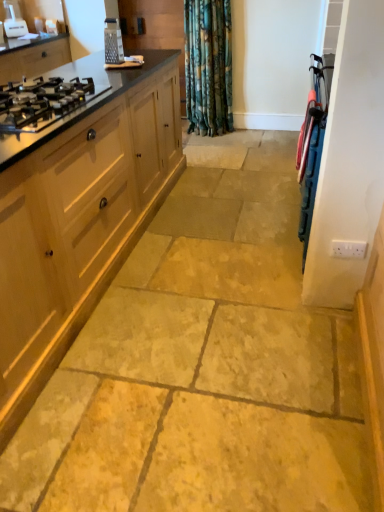
What do you see at coordinates (43, 102) in the screenshot? I see `black glass gas stove at left` at bounding box center [43, 102].

The image size is (384, 512). What do you see at coordinates (349, 161) in the screenshot?
I see `blue plastic screen door at right` at bounding box center [349, 161].

This screenshot has width=384, height=512. Find the location of `black glass gas stove at left`. black glass gas stove at left is located at coordinates (x=43, y=102).

Does point (115, 240) come closer to viewer compared to point (10, 7)?

Yes, it is.

Measure the distance between light wood cabinet at left, placed as the 1th cabinetry when sorted from right to left, and white plastic appliance at upper left, which appears as the 2th appliance when ordered from the bottom.

7.23 feet.

From the image's perspective, is light wood cabinet at left, placed as the first cabinetry when sorted from front to back, positioned above or below white plastic appliance at upper left, the 1th appliance positioned from the left?

Based on their image positions, light wood cabinet at left, placed as the first cabinetry when sorted from front to back, is located beneath white plastic appliance at upper left, the 1th appliance positioned from the left.

Considering the sizes of objects light wood cabinet at left, placed as the 1th cabinetry when sorted from right to left, and white plastic appliance at upper left, the second appliance viewed from the front, in the image provided, who is taller, light wood cabinet at left, placed as the 1th cabinetry when sorted from right to left, or white plastic appliance at upper left, the second appliance viewed from the front,?

light wood cabinet at left, placed as the 1th cabinetry when sorted from right to left, is taller.

Which is more to the left, black glass gas stove at left or light wood cabinet at left, positioned as the 2th cabinetry in back-to-front order?

black glass gas stove at left is more to the left.

From the image's perspective, which object appears higher, black glass gas stove at left or light wood cabinet at left, placed as the first cabinetry when sorted from front to back?

black glass gas stove at left, from the image's perspective.

Identify the location of gas stove on the left side of light wood cabinet at left, which ranks as the second cabinetry in left-to-right order. (43, 102).

Based on the photo, is the depth of black glass gas stove at left less than that of light wood cabinet at left, which ranks as the second cabinetry in left-to-right order?

No, black glass gas stove at left is behind light wood cabinet at left, which ranks as the second cabinetry in left-to-right order.

Is there a large distance between light wood cabinet at left, which is counted as the 2th cabinetry, starting from the top, and metallic grater at upper left, arranged as the 2th appliance when viewed from the back?

Yes, light wood cabinet at left, which is counted as the 2th cabinetry, starting from the top, and metallic grater at upper left, arranged as the 2th appliance when viewed from the back, are located far from each other.

Relative to metallic grater at upper left, the first appliance from the bottom, is light wood cabinet at left, positioned as the 2th cabinetry in back-to-front order, in front or behind?

light wood cabinet at left, positioned as the 2th cabinetry in back-to-front order, is in front of metallic grater at upper left, the first appliance from the bottom.

Can you confirm if light wood cabinet at left, placed as the 1th cabinetry when sorted from right to left, is positioned to the left of metallic grater at upper left, acting as the first appliance starting from the right?

Yes.

Considering the relative sizes of light wood cabinet at left, positioned as the 2th cabinetry in back-to-front order, and metallic grater at upper left, the first appliance from the bottom, in the image provided, is light wood cabinet at left, positioned as the 2th cabinetry in back-to-front order, bigger than metallic grater at upper left, the first appliance from the bottom,?

Yes.

Between matte wood stove at upper left, positioned as the 2th cabinetry in bottom-to-top order, and light wood cabinet at left, placed as the 1th cabinetry when sorted from right to left, which one has smaller width?

light wood cabinet at left, placed as the 1th cabinetry when sorted from right to left, is thinner.

Is matte wood stove at upper left, placed as the second cabinetry when sorted from right to left, turned away from light wood cabinet at left, placed as the first cabinetry when sorted from front to back?

No, matte wood stove at upper left, placed as the second cabinetry when sorted from right to left,'s orientation is not away from light wood cabinet at left, placed as the first cabinetry when sorted from front to back.

From a real-world perspective, is matte wood stove at upper left, the 2th cabinetry positioned from the front, positioned above or below light wood cabinet at left, positioned as the 2th cabinetry in back-to-front order?

From a real-world perspective, matte wood stove at upper left, the 2th cabinetry positioned from the front, is physically above light wood cabinet at left, positioned as the 2th cabinetry in back-to-front order.

Based on the photo, what's the angular difference between matte wood stove at upper left, the 2th cabinetry positioned from the front, and light wood cabinet at left, placed as the first cabinetry when sorted from front to back,'s facing directions?

The angular difference between matte wood stove at upper left, the 2th cabinetry positioned from the front, and light wood cabinet at left, placed as the first cabinetry when sorted from front to back, is 0.299 degrees.

Considering their positions, is metallic grater at upper left, acting as the first appliance starting from the right, located in front of or behind matte wood stove at upper left, which is counted as the first cabinetry, starting from the left?

Visually, metallic grater at upper left, acting as the first appliance starting from the right, is located in front of matte wood stove at upper left, which is counted as the first cabinetry, starting from the left.

Is metallic grater at upper left, which appears as the second appliance when viewed from the top, positioned with its back to matte wood stove at upper left, placed as the second cabinetry when sorted from right to left?

No, metallic grater at upper left, which appears as the second appliance when viewed from the top,'s orientation is not away from matte wood stove at upper left, placed as the second cabinetry when sorted from right to left.

Consider the image. Is metallic grater at upper left, which ranks as the 1th appliance in front-to-back order, touching matte wood stove at upper left, positioned as the 2th cabinetry in bottom-to-top order?

metallic grater at upper left, which ranks as the 1th appliance in front-to-back order, is not next to matte wood stove at upper left, positioned as the 2th cabinetry in bottom-to-top order, and they're not touching.

From the image's perspective, is matte wood stove at upper left, which is counted as the first cabinetry, starting from the left, located above or below metallic grater at upper left, arranged as the 2th appliance when viewed from the left?

Clearly, from the image's perspective, matte wood stove at upper left, which is counted as the first cabinetry, starting from the left, is above metallic grater at upper left, arranged as the 2th appliance when viewed from the left.

What's the angular difference between matte wood stove at upper left, the 2th cabinetry positioned from the front, and metallic grater at upper left, which ranks as the 1th appliance in front-to-back order,'s facing directions?

The angular difference between matte wood stove at upper left, the 2th cabinetry positioned from the front, and metallic grater at upper left, which ranks as the 1th appliance in front-to-back order, is 0.29 degrees.

Consider the image. From a real-world perspective, which object stands above the other?

metallic grater at upper left, which appears as the second appliance when viewed from the top, is physically above.

Is light wood cabinet at left, positioned as the 2th cabinetry in back-to-front order, shorter than blue plastic screen door at right?

Correct, light wood cabinet at left, positioned as the 2th cabinetry in back-to-front order, is not as tall as blue plastic screen door at right.

Looking at this image, is light wood cabinet at left, placed as the 1th cabinetry when sorted from right to left, far from blue plastic screen door at right?

Yes, light wood cabinet at left, placed as the 1th cabinetry when sorted from right to left, and blue plastic screen door at right are quite far apart.

Looking at this image, can you confirm if light wood cabinet at left, positioned as the 2th cabinetry in back-to-front order, is smaller than blue plastic screen door at right?

No, light wood cabinet at left, positioned as the 2th cabinetry in back-to-front order, is not smaller than blue plastic screen door at right.

How different are the orientations of light wood cabinet at left, which is the first cabinetry from bottom to top, and blue plastic screen door at right in degrees?

89.6 degrees.

There is a white plastic appliance at upper left, which is the first appliance from top to bottom. Identify the location of the 2nd cabinetry below it (from the image's perspective). (79, 217).

Identify the location of gas stove lying on the left of light wood cabinet at left, which ranks as the second cabinetry in left-to-right order. (43, 102).

Considering their positions, is metallic grater at upper left, which appears as the second appliance when viewed from the top, positioned closer to white plastic appliance at upper left, the second appliance from the right, than matte wood stove at upper left, positioned as the first cabinetry in top-to-bottom order?

matte wood stove at upper left, positioned as the first cabinetry in top-to-bottom order, lies closer to white plastic appliance at upper left, the second appliance from the right, than the other object.

Looking at the image, which one is located further to metallic grater at upper left, arranged as the 2th appliance when viewed from the left, black glass gas stove at left or matte wood stove at upper left, placed as the second cabinetry when sorted from right to left?

Among the two, black glass gas stove at left is located further to metallic grater at upper left, arranged as the 2th appliance when viewed from the left.

Based on their spatial positions, is white plastic appliance at upper left, the second appliance from the right, or black glass gas stove at left further from metallic grater at upper left, the first appliance from the bottom?

black glass gas stove at left is further to metallic grater at upper left, the first appliance from the bottom.

Which object lies further to the anchor point black glass gas stove at left, blue plastic screen door at right or matte wood stove at upper left, placed as the second cabinetry when sorted from right to left?

matte wood stove at upper left, placed as the second cabinetry when sorted from right to left, is further to black glass gas stove at left.

Looking at the image, which one is located further to matte wood stove at upper left, which is counted as the first cabinetry, starting from the left, light wood cabinet at left, which is the first cabinetry from bottom to top, or metallic grater at upper left, the first appliance from the bottom?

Based on the image, light wood cabinet at left, which is the first cabinetry from bottom to top, appears to be further to matte wood stove at upper left, which is counted as the first cabinetry, starting from the left.

From the image, which object appears to be nearer to black glass gas stove at left, white plastic appliance at upper left, the first appliance when ordered from back to front, or matte wood stove at upper left, which appears as the first cabinetry when viewed from the back?

matte wood stove at upper left, which appears as the first cabinetry when viewed from the back, is closer to black glass gas stove at left.

Considering their positions, is matte wood stove at upper left, positioned as the first cabinetry in top-to-bottom order, positioned further to black glass gas stove at left than light wood cabinet at left, which is the first cabinetry from bottom to top?

Among the two, matte wood stove at upper left, positioned as the first cabinetry in top-to-bottom order, is located further to black glass gas stove at left.

Estimate the real-world distances between objects in this image. Which object is further from light wood cabinet at left, placed as the 1th cabinetry when sorted from right to left, black glass gas stove at left or white plastic appliance at upper left, which is the first appliance from top to bottom?

Among the two, white plastic appliance at upper left, which is the first appliance from top to bottom, is located further to light wood cabinet at left, placed as the 1th cabinetry when sorted from right to left.

This screenshot has height=512, width=384. What are the coordinates of `cabinetry located between black glass gas stove at left and blue plastic screen door at right in the left-right direction` in the screenshot? It's located at (79, 217).

Locate an element on the screen. appliance between light wood cabinet at left, which is the first cabinetry from bottom to top, and matte wood stove at upper left, which appears as the first cabinetry when viewed from the back, along the z-axis is located at coordinates click(113, 42).

The height and width of the screenshot is (512, 384). I want to click on gas stove located between light wood cabinet at left, which is counted as the 2th cabinetry, starting from the top, and metallic grater at upper left, arranged as the 2th appliance when viewed from the left, in the depth direction, so (43, 102).

I want to click on appliance positioned between black glass gas stove at left and white plastic appliance at upper left, the first appliance when ordered from back to front, from near to far, so click(113, 42).